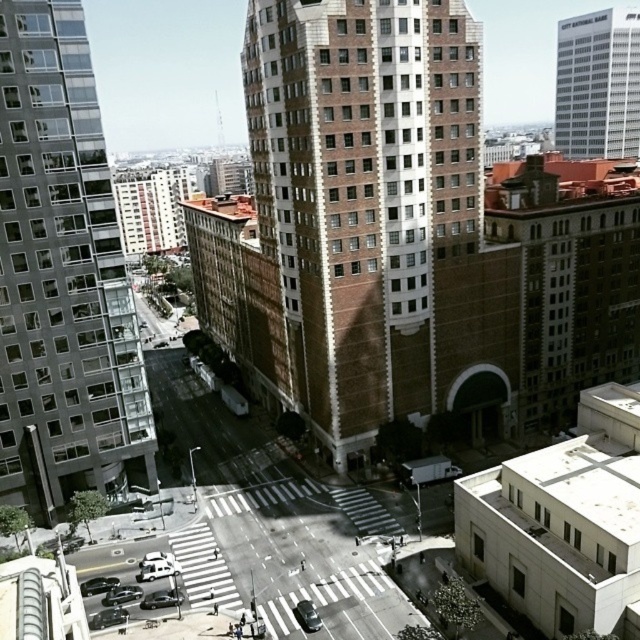
You are standing at the city intersection and want to take a photo of the glassy reflective building at left. Considering the distance, do you think you can capture the entire building in your smartphone camera without moving closer? Assume your smartphone has a standard 28mm wide angle lens.

The glassy reflective building at left is 64.52 meters away from the viewer. With a standard 28mm wide angle lens, capturing the entire building at that distance would depend on the building height and your camera angle. However, since the building is a tall structure and you are 64.52 meters away, it is likely possible to fit it within the frame without needing to move closer, provided you position yourself appropriately.

You are a city planner analyzing the urban layout. Given the brown brick building at center and the white glass skyscraper at upper right, which structure takes up more area in the cityscape?

The white glass skyscraper at upper right occupies more space than the brown brick building at center according to the description.